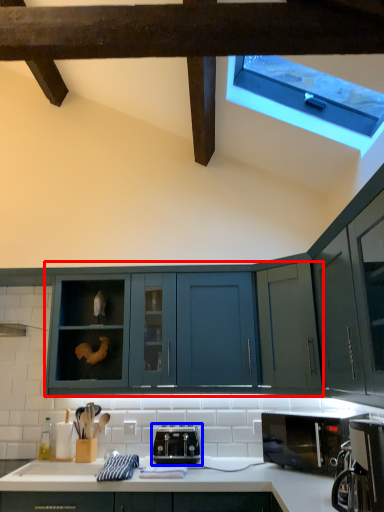
Question: Among these objects, which one is farthest to the camera, cabinetry (highlighted by a red box) or toaster (highlighted by a blue box)?

Choices:
 (A) cabinetry
 (B) toaster

Answer: (A)